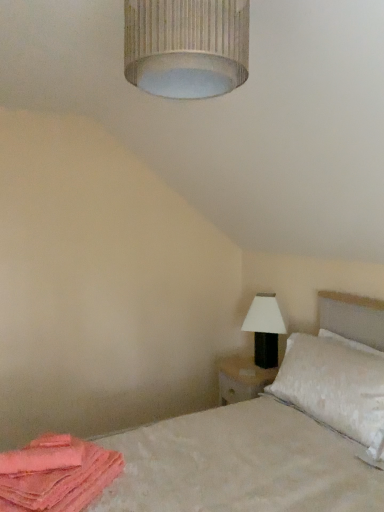
Question: Is white textured pillow at right wider than white textured bed at lower right?

Choices:
 (A) yes
 (B) no

Answer: (B)

Question: Is white textured pillow at right bigger than white textured bed at lower right?

Choices:
 (A) yes
 (B) no

Answer: (B)

Question: From a real-world perspective, is white textured pillow at right over white textured bed at lower right?

Choices:
 (A) yes
 (B) no

Answer: (A)

Question: Would you say white textured pillow at right contains white textured bed at lower right?

Choices:
 (A) yes
 (B) no

Answer: (B)

Question: Is white textured pillow at right positioned with its back to white textured bed at lower right?

Choices:
 (A) yes
 (B) no

Answer: (A)

Question: From the image's perspective, is white textured pillow at right on top of white textured bed at lower right?

Choices:
 (A) yes
 (B) no

Answer: (A)

Question: Is pink fabric at lower left at the right side of white textured bed at lower right?

Choices:
 (A) yes
 (B) no

Answer: (B)

Question: Could you tell me if pink fabric at lower left is facing white textured bed at lower right?

Choices:
 (A) no
 (B) yes

Answer: (B)

Question: Is pink fabric at lower left turned away from white textured bed at lower right?

Choices:
 (A) no
 (B) yes

Answer: (B)

Question: Is pink fabric at lower left positioned far away from white textured bed at lower right?

Choices:
 (A) yes
 (B) no

Answer: (B)

Question: Considering the relative sizes of pink fabric at lower left and white textured bed at lower right in the image provided, is pink fabric at lower left taller than white textured bed at lower right?

Choices:
 (A) no
 (B) yes

Answer: (A)

Question: Can you see pink fabric at lower left touching white textured bed at lower right?

Choices:
 (A) no
 (B) yes

Answer: (A)

Question: From a real-world perspective, is white textured pillow at right positioned over pink fabric at lower left based on gravity?

Choices:
 (A) yes
 (B) no

Answer: (A)